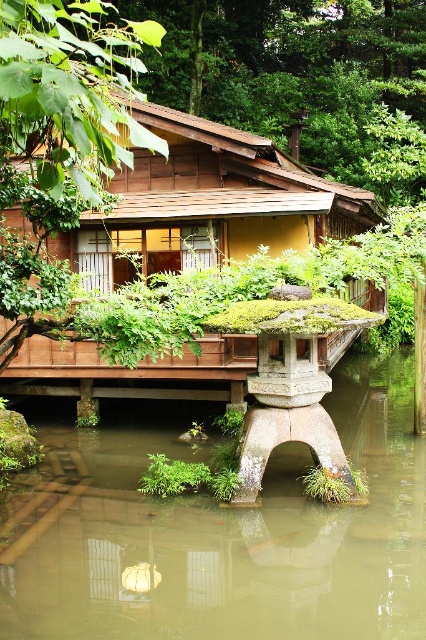
You are a visitor approaching the wooden hut at center and notice the green mossy stone at lower center nearby. Can you determine if the stone is wider than the hut?

The green mossy stone at lower center might be wider than wooden hut at center according to the description provided.

You are standing on the wooden deck of the traditional Japanese house and want to place a small decorative item. The green mossy stone at lower center is located at point (226, 534). Where should you place the item to ensure it is directly in front of the house?

The green mossy stone at lower center is located at point (226, 534), so placing the item there would position it directly in front of the house.